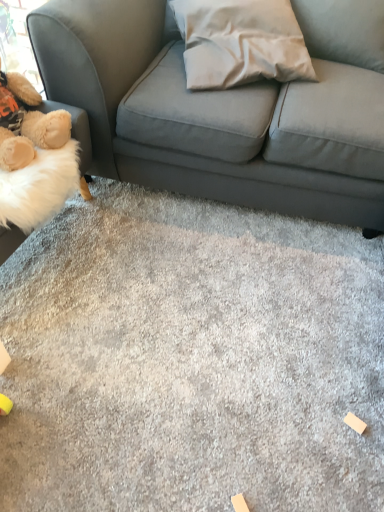
The width and height of the screenshot is (384, 512). What do you see at coordinates (27, 123) in the screenshot?
I see `fluffy beige teddy bear at left` at bounding box center [27, 123].

What is the approximate width of fluffy beige teddy bear at left?

It is 14.28 inches.

Describe the element at coordinates (240, 42) in the screenshot. The width and height of the screenshot is (384, 512). I see `white fabric pillow at center` at that location.

Find the location of a particular element. This screenshot has width=384, height=512. fluffy beige teddy bear at left is located at coordinates (27, 123).

Is fluffy beige teddy bear at left oriented away from white fabric pillow at center?

No, fluffy beige teddy bear at left is not facing the opposite direction of white fabric pillow at center.

Is the depth of fluffy beige teddy bear at left less than that of white fabric pillow at center?

Yes, it is.

From the image's perspective, is fluffy beige teddy bear at left under white fabric pillow at center?

Indeed, from the image's perspective, fluffy beige teddy bear at left is shown beneath white fabric pillow at center.

Is white fabric pillow at center located outside fluffy beige teddy bear at left?

Absolutely, white fabric pillow at center is external to fluffy beige teddy bear at left.

From the image's perspective, which object appears higher, white fabric pillow at center or fluffy beige teddy bear at left?

white fabric pillow at center is shown above in the image.

The height and width of the screenshot is (512, 384). What are the coordinates of `throw pillow that is above the fluffy beige teddy bear at left (from the image's perspective)` in the screenshot? It's located at (240, 42).

Which object is wider, fluffy beige teddy bear at left or gray carpet at center?

Wider between the two is gray carpet at center.

Who is taller, fluffy beige teddy bear at left or gray carpet at center?

fluffy beige teddy bear at left is taller.

Are fluffy beige teddy bear at left and gray carpet at center beside each other?

No.

From the picture: Is gray carpet at center inside or outside of white fabric pillow at center?

gray carpet at center exists outside the volume of white fabric pillow at center.

Does gray carpet at center turn towards white fabric pillow at center?

No, gray carpet at center is not facing towards white fabric pillow at center.

Is gray carpet at center in contact with white fabric pillow at center?

gray carpet at center is not next to white fabric pillow at center, and they're not touching.

From the image's perspective, relative to white fabric pillow at center, is gray carpet at center above or below?

Clearly, from the image's perspective, gray carpet at center is below white fabric pillow at center.

Based on the photo, relative to fluffy beige teddy bear at left, is gray carpet at center in front or behind?

In the image, gray carpet at center appears in front of fluffy beige teddy bear at left.

Between gray carpet at center and fluffy beige teddy bear at left, which one appears on the left side from the viewer's perspective?

fluffy beige teddy bear at left.

Is point (129, 350) positioned behind point (4, 159)?

That is False.

Considering the sizes of objects white fabric pillow at center and gray carpet at center in the image provided, who is taller, white fabric pillow at center or gray carpet at center?

With more height is white fabric pillow at center.

At what (x,y) coordinates should I click in order to perform the action: click on concrete below the white fabric pillow at center (from the image's perspective). Please return your answer as a coordinate pair (x, y). Looking at the image, I should click on (191, 359).

Which is behind, white fabric pillow at center or gray carpet at center?

white fabric pillow at center is behind.

Are white fabric pillow at center and gray carpet at center beside each other?

No, white fabric pillow at center is not in contact with gray carpet at center.

Locate an element on the screen. The height and width of the screenshot is (512, 384). toy that is under the white fabric pillow at center (from a real-world perspective) is located at coordinates (27, 123).

At what (x,y) coordinates should I click in order to perform the action: click on throw pillow that appears on the right of fluffy beige teddy bear at left. Please return your answer as a coordinate pair (x, y). This screenshot has height=512, width=384. Looking at the image, I should click on (240, 42).

From the image, which object appears to be farther from white fabric pillow at center, gray carpet at center or fluffy beige teddy bear at left?

Based on the image, gray carpet at center appears to be further to white fabric pillow at center.

Looking at the image, which one is located further to gray carpet at center, white fabric pillow at center or fluffy beige teddy bear at left?

white fabric pillow at center is positioned further to the anchor gray carpet at center.

Based on their spatial positions, is fluffy beige teddy bear at left or white fabric pillow at center closer to gray carpet at center?

Among the two, fluffy beige teddy bear at left is located nearer to gray carpet at center.

Estimate the real-world distances between objects in this image. Which object is closer to fluffy beige teddy bear at left, white fabric pillow at center or gray carpet at center?

white fabric pillow at center is positioned closer to the anchor fluffy beige teddy bear at left.

Estimate the real-world distances between objects in this image. Which object is further from white fabric pillow at center, fluffy beige teddy bear at left or gray carpet at center?

Based on the image, gray carpet at center appears to be further to white fabric pillow at center.

Looking at the image, which one is located closer to fluffy beige teddy bear at left, gray carpet at center or white fabric pillow at center?

white fabric pillow at center lies closer to fluffy beige teddy bear at left than the other object.

This screenshot has height=512, width=384. I want to click on toy between white fabric pillow at center and gray carpet at center from top to bottom, so click(x=27, y=123).